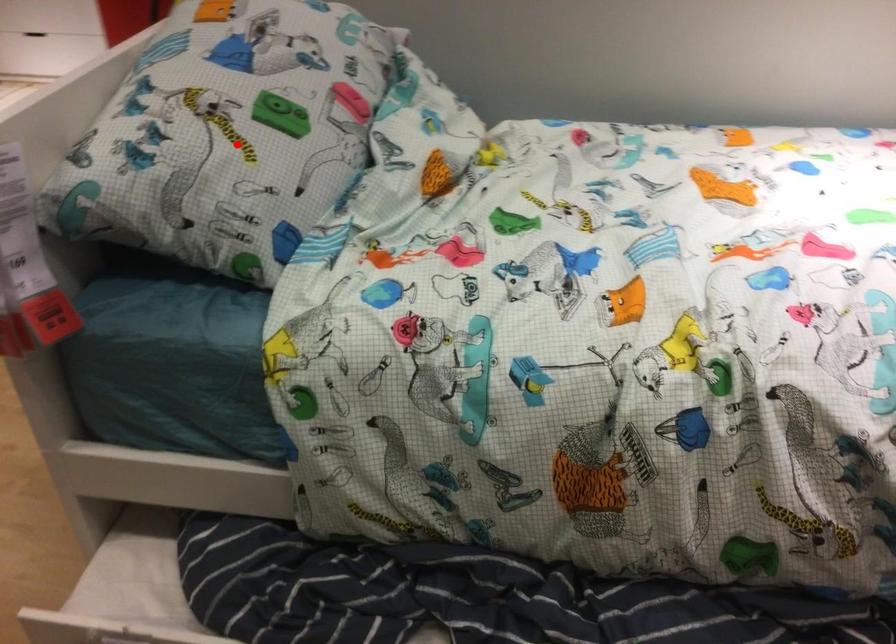
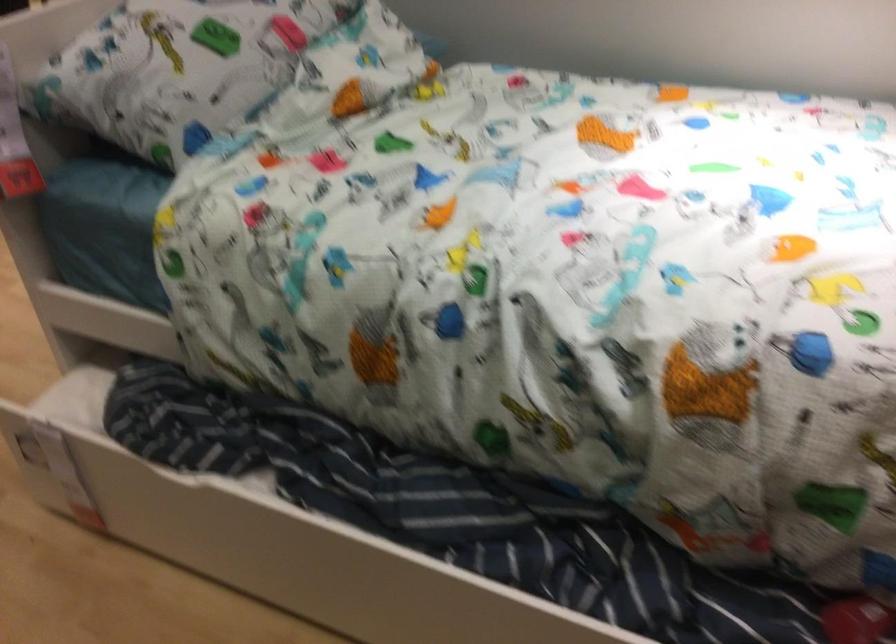
Question: I am providing you with two images of the same scene from different viewpoints. A red point is shown in image1. For the corresponding object point in image2, is it positioned nearer or farther from the camera?

Choices:
 (A) Nearer
 (B) Farther

Answer: (B)